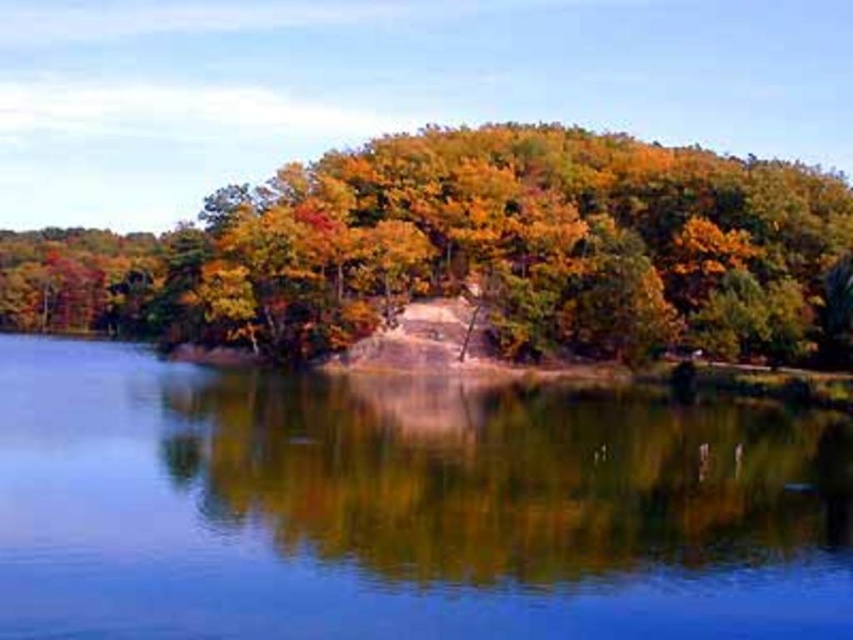
Question: From the image, what is the correct spatial relationship of clear water at center in relation to shiny golden leaves at center?

Choices:
 (A) right
 (B) left

Answer: (A)

Question: Which of the following is the farthest from the observer?

Choices:
 (A) clear water at center
 (B) shiny golden leaves at center

Answer: (B)

Question: Does clear water at center have a greater width compared to shiny golden leaves at center?

Choices:
 (A) no
 (B) yes

Answer: (A)

Question: Which of the following is the farthest from the observer?

Choices:
 (A) shiny golden leaves at center
 (B) clear water at center

Answer: (A)

Question: Is clear water at center positioned in front of shiny golden leaves at center?

Choices:
 (A) yes
 (B) no

Answer: (A)